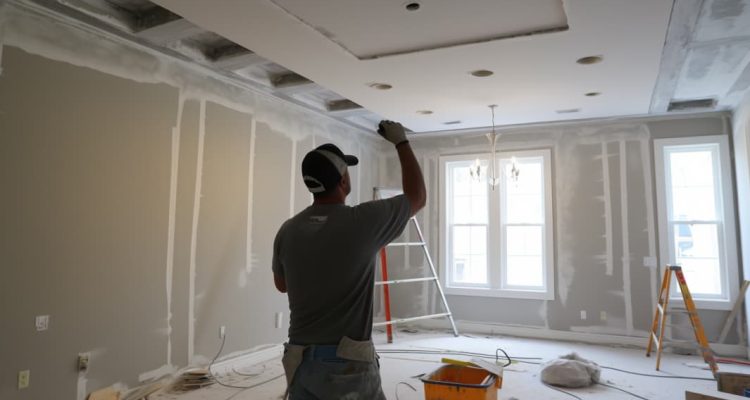
Find the location of a particular element. tray ceiling is located at coordinates (412, 31).